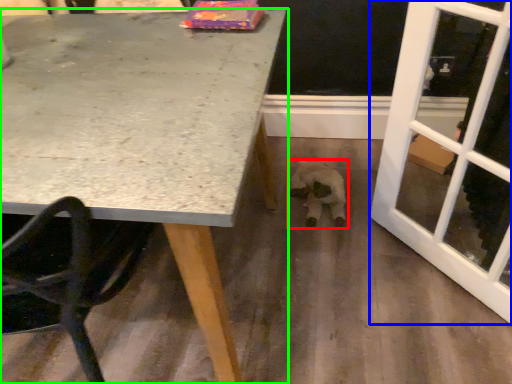
Question: Considering the real-world distances, which object is farthest from animal (highlighted by a red box)? screen door (highlighted by a blue box) or table (highlighted by a green box)?

Choices:
 (A) screen door
 (B) table

Answer: (B)